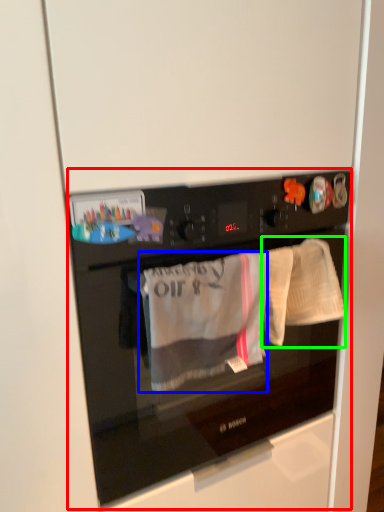
Question: Estimate the real-world distances between objects in this image. Which object is farther from home appliance (highlighted by a red box), clothing (highlighted by a blue box) or baby clothe (highlighted by a green box)?

Choices:
 (A) clothing
 (B) baby clothe

Answer: (B)